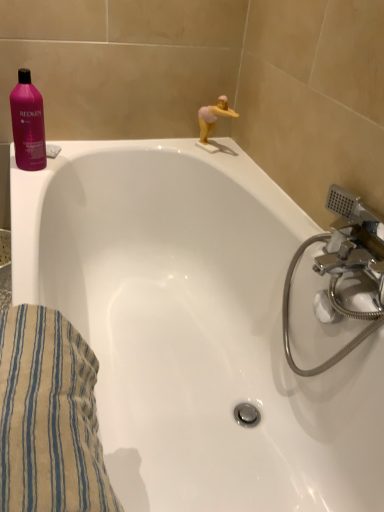
Question: Is beige striped towel at lower left taller than pink glossy shampoo at upper left?

Choices:
 (A) yes
 (B) no

Answer: (A)

Question: Is pink glossy shampoo at upper left located within beige striped towel at lower left?

Choices:
 (A) yes
 (B) no

Answer: (B)

Question: Is the depth of beige striped towel at lower left less than that of pink glossy shampoo at upper left?

Choices:
 (A) no
 (B) yes

Answer: (B)

Question: Is beige striped towel at lower left located outside pink glossy shampoo at upper left?

Choices:
 (A) no
 (B) yes

Answer: (B)

Question: Is beige striped towel at lower left with pink glossy shampoo at upper left?

Choices:
 (A) no
 (B) yes

Answer: (A)

Question: Is beige striped towel at lower left thinner than pink glossy shampoo at upper left?

Choices:
 (A) yes
 (B) no

Answer: (B)

Question: Is beige striped towel at lower left behind pink rubber duck at upper right?

Choices:
 (A) no
 (B) yes

Answer: (A)

Question: Is beige striped towel at lower left taller than pink rubber duck at upper right?

Choices:
 (A) yes
 (B) no

Answer: (A)

Question: Is pink rubber duck at upper right completely or partially inside beige striped towel at lower left?

Choices:
 (A) no
 (B) yes

Answer: (A)

Question: Is beige striped towel at lower left turned away from pink rubber duck at upper right?

Choices:
 (A) yes
 (B) no

Answer: (B)

Question: Could you tell me if beige striped towel at lower left is turned towards pink rubber duck at upper right?

Choices:
 (A) yes
 (B) no

Answer: (B)

Question: Would you say beige striped towel at lower left is outside pink rubber duck at upper right?

Choices:
 (A) no
 (B) yes

Answer: (B)

Question: Can we say white glossy bathtub at upper left lies outside pink glossy shampoo at upper left?

Choices:
 (A) yes
 (B) no

Answer: (A)